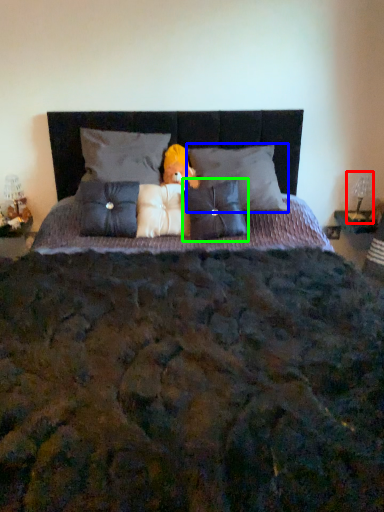
Question: Estimate the real-world distances between objects in this image. Which object is closer to table lamp (highlighted by a red box), pillow (highlighted by a blue box) or pillow (highlighted by a green box)?

Choices:
 (A) pillow
 (B) pillow

Answer: (A)